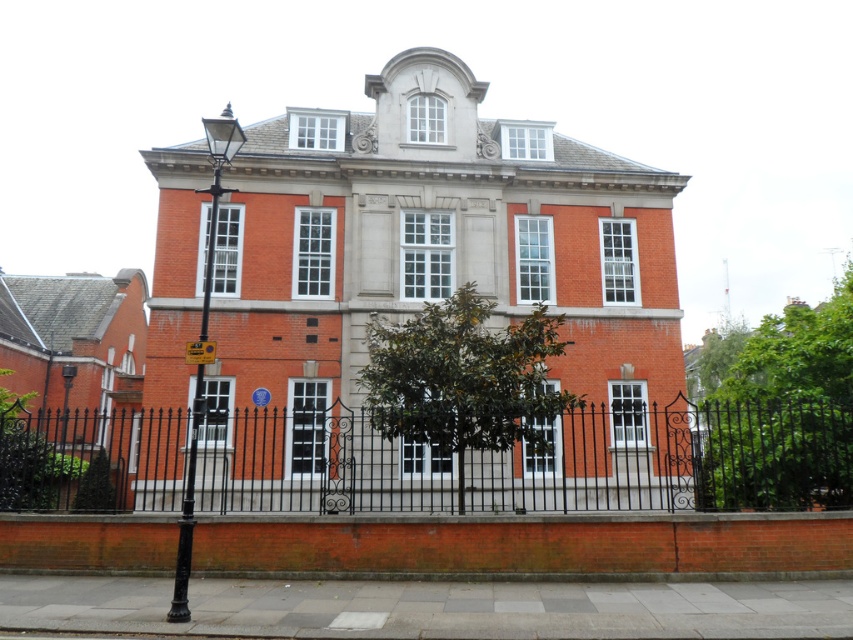
You are standing at point (54, 461) and want to reach the entrance of the two story building. The entrance is located at the center of the building. If you walk straight towards the entrance, will you hit the black wrought iron fence before reaching the entrance?

The distance between you at point (54, 461) and the entrance is 33.23 meters. Since the black wrought iron fence encloses the building perimeter, you would have to walk around it to reach the entrance without hitting the fence. Therefore, walking straight towards the entrance would result in hitting the fence before reaching the entrance.

You are a delivery person trying to deliver a package to the building. You see the black wrought iron fence at center and the yellow plastic sign at lower left. Which object is taller?

The black wrought iron fence at center is much taller than the yellow plastic sign at lower left.

You are standing at the point with coordinates (537, 461) in the image. What object is located exactly at this point?

The black wrought iron fence at center is located exactly at point (537, 461).